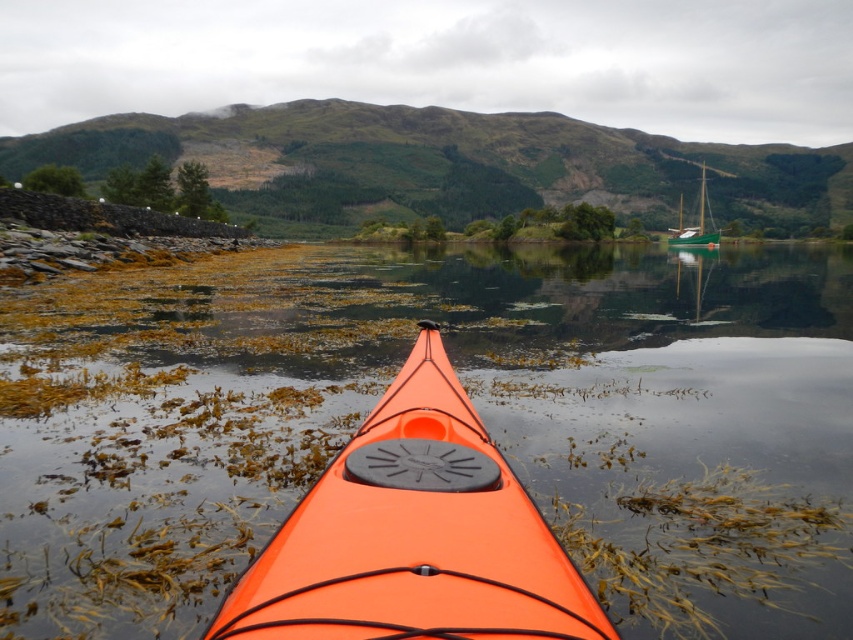
Which is below, translucent seaweed at center or orange matte kayak at center?

orange matte kayak at center

Does translucent seaweed at center have a lesser width compared to orange matte kayak at center?

Incorrect, translucent seaweed at center's width is not less than orange matte kayak at center's.

Locate an element on the screen. translucent seaweed at center is located at coordinates (473, 404).

At what (x,y) coordinates should I click in order to perform the action: click on orange matte kayak at center. Please return your answer as a coordinate pair (x, y). The image size is (853, 640). Looking at the image, I should click on (415, 536).

The height and width of the screenshot is (640, 853). Identify the location of orange matte kayak at center. (415, 536).

Is translucent seaweed at center taller than green glossy sailboat at right?

No.

Is translucent seaweed at center to the left of green glossy sailboat at right from the viewer's perspective?

Indeed, translucent seaweed at center is positioned on the left side of green glossy sailboat at right.

Does point (236, 342) come farther from viewer compared to point (693, 244)?

No, (236, 342) is closer to viewer.

Where is `translucent seaweed at center`? The image size is (853, 640). translucent seaweed at center is located at coordinates (473, 404).